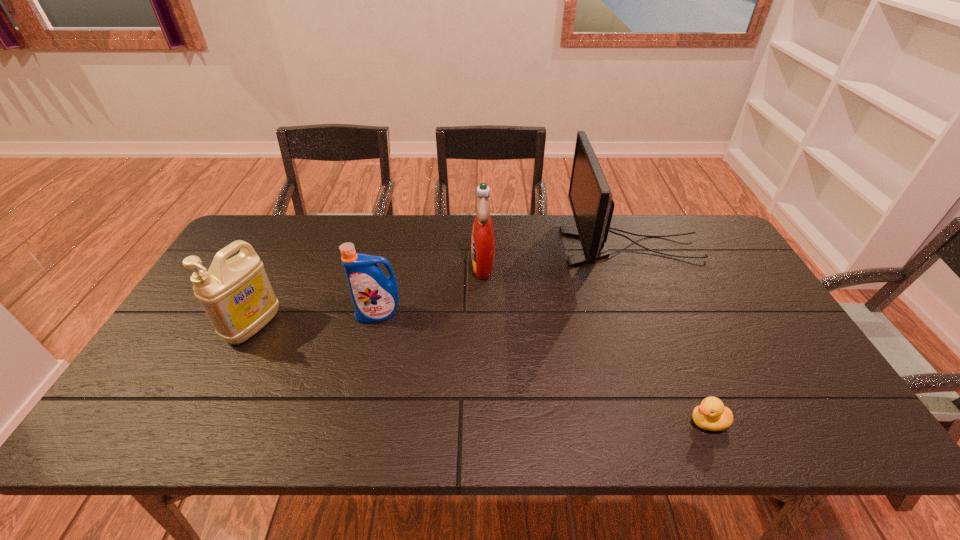
Locate which object is the second closest to the second detergent from left to right. Please provide its 2D coordinates. Your answer should be formatted as a tuple, i.e. [(x, y)], where the tuple contains the x and y coordinates of a point satisfying the conditions above.

[(483, 238)]

Identify which object is located as the nearest to the nearest object. Please provide its 2D coordinates. Your answer should be formatted as a tuple, i.e. [(x, y)], where the tuple contains the x and y coordinates of a point satisfying the conditions above.

[(590, 197)]

Where is `detergent that is the second closest to the fourth object from right to left`? Image resolution: width=960 pixels, height=540 pixels. detergent that is the second closest to the fourth object from right to left is located at coordinates (483, 238).

Find the location of `detergent that is the second closest one to the leftmost detergent`. detergent that is the second closest one to the leftmost detergent is located at coordinates (483, 238).

At what (x,y) coordinates should I click in order to perform the action: click on vacant area that satisfies the following two spatial constraints: 1. on the front surface of the rightmost detergent; 2. on the front side of the leftmost detergent. Please return your answer as a coordinate pair (x, y). Looking at the image, I should click on (484, 326).